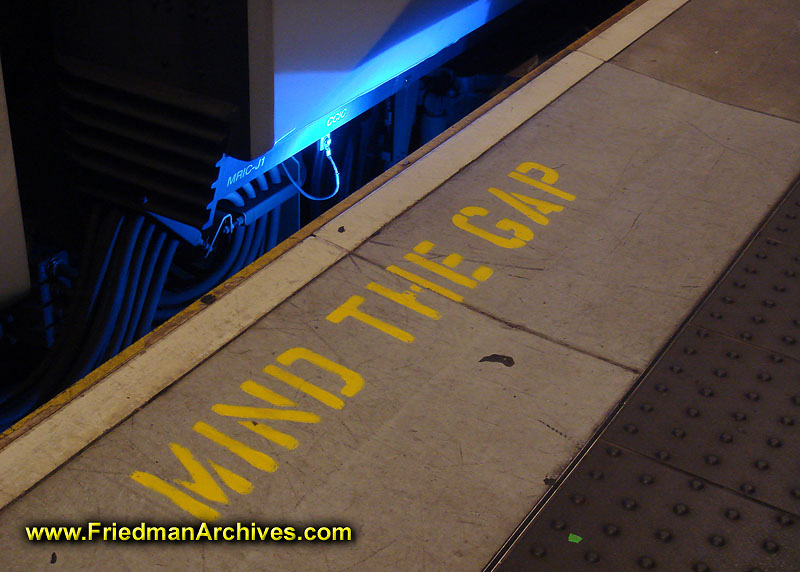
You are a GUI agent. You are given a task and a screenshot of the screen. Output one action in this format:
    pyautogui.click(x=<x>, y=<y>)
    Task: Click on the long crack in flooring
    Image resolution: width=800 pixels, height=572 pixels.
    Given the screenshot: What is the action you would take?
    pyautogui.click(x=669, y=467)